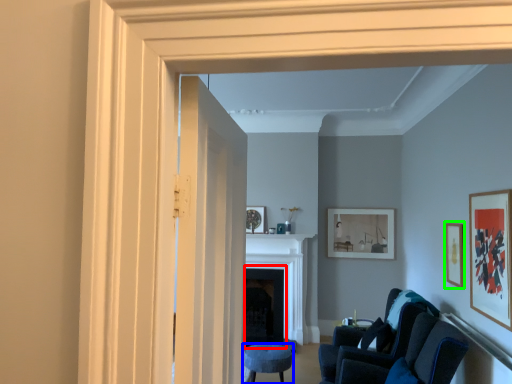
Question: Considering the real-world distances, which object is closest to fireplace (highlighted by a red box)? furniture (highlighted by a blue box) or picture frame (highlighted by a green box).

Choices:
 (A) furniture
 (B) picture frame

Answer: (A)